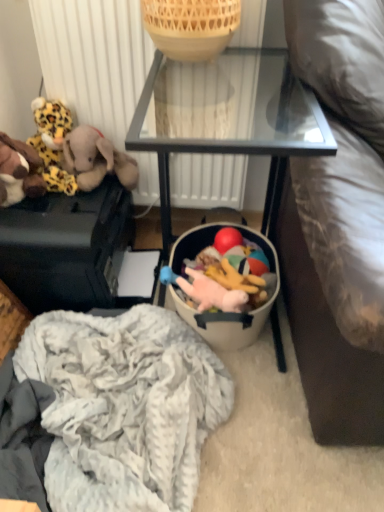
Question: Does rubber ball at center, acting as the first toy starting from the right, have a lesser width compared to matte black suitcase at left, the second furniture positioned from the right?

Choices:
 (A) no
 (B) yes

Answer: (B)

Question: Is rubber ball at center, the 5th toy positioned from the left, further to the viewer compared to matte black suitcase at left, the second furniture positioned from the right?

Choices:
 (A) no
 (B) yes

Answer: (B)

Question: Is rubber ball at center, the 5th toy positioned from the left, at the right side of matte black suitcase at left, the second furniture positioned from the right?

Choices:
 (A) no
 (B) yes

Answer: (B)

Question: Can you confirm if rubber ball at center, acting as the first toy starting from the right, is shorter than matte black suitcase at left, the second furniture positioned from the right?

Choices:
 (A) no
 (B) yes

Answer: (B)

Question: From the image's perspective, does rubber ball at center, the 5th toy positioned from the left, appear lower than matte black suitcase at left, the second furniture positioned from the right?

Choices:
 (A) yes
 (B) no

Answer: (A)

Question: From a real-world perspective, relative to brown plush elephant at left, the 3th toy from the left, is bamboo basket at upper center vertically above or below?

Choices:
 (A) above
 (B) below

Answer: (A)

Question: Would you say bamboo basket at upper center is inside or outside brown plush elephant at left, acting as the third toy starting from the right?

Choices:
 (A) inside
 (B) outside

Answer: (B)

Question: Is point (213, 49) positioned closer to the camera than point (66, 139)?

Choices:
 (A) farther
 (B) closer

Answer: (B)

Question: Considering their positions, is bamboo basket at upper center located in front of or behind brown plush elephant at left, acting as the third toy starting from the right?

Choices:
 (A) behind
 (B) front

Answer: (B)

Question: Looking at the image, does white textured radiator at upper center seem bigger or smaller compared to bamboo basket at upper center?

Choices:
 (A) big
 (B) small

Answer: (A)

Question: Considering the relative positions of white textured radiator at upper center and bamboo basket at upper center in the image provided, is white textured radiator at upper center to the left or to the right of bamboo basket at upper center?

Choices:
 (A) right
 (B) left

Answer: (B)

Question: From the image's perspective, is white textured radiator at upper center located above or below bamboo basket at upper center?

Choices:
 (A) above
 (B) below

Answer: (B)

Question: From a real-world perspective, is white textured radiator at upper center positioned above or below bamboo basket at upper center?

Choices:
 (A) below
 (B) above

Answer: (A)

Question: Based on their sizes in the image, would you say matte black suitcase at left, the second furniture positioned from the right, is bigger or smaller than bamboo basket at upper center?

Choices:
 (A) big
 (B) small

Answer: (A)

Question: Visually, is matte black suitcase at left, the second furniture positioned from the right, positioned to the left or to the right of bamboo basket at upper center?

Choices:
 (A) left
 (B) right

Answer: (A)